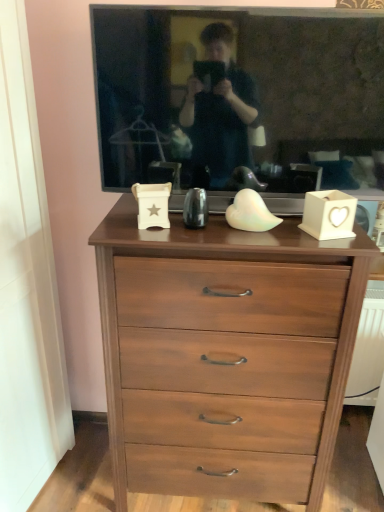
Question: Is walnut wood chest of drawers at center to the left of matte black tv at upper center from the viewer's perspective?

Choices:
 (A) yes
 (B) no

Answer: (A)

Question: Can you confirm if walnut wood chest of drawers at center is thinner than matte black tv at upper center?

Choices:
 (A) yes
 (B) no

Answer: (B)

Question: From a real-world perspective, is walnut wood chest of drawers at center over matte black tv at upper center?

Choices:
 (A) yes
 (B) no

Answer: (B)

Question: Is walnut wood chest of drawers at center oriented towards matte black tv at upper center?

Choices:
 (A) no
 (B) yes

Answer: (A)

Question: Are walnut wood chest of drawers at center and matte black tv at upper center beside each other?

Choices:
 (A) yes
 (B) no

Answer: (B)

Question: Is walnut wood chest of drawers at center further to camera compared to matte black tv at upper center?

Choices:
 (A) no
 (B) yes

Answer: (B)

Question: Can you confirm if matte black tv at upper center is shorter than walnut wood chest of drawers at center?

Choices:
 (A) no
 (B) yes

Answer: (B)

Question: Is matte black tv at upper center at the left side of walnut wood chest of drawers at center?

Choices:
 (A) yes
 (B) no

Answer: (B)

Question: Is matte black tv at upper center in front of walnut wood chest of drawers at center?

Choices:
 (A) no
 (B) yes

Answer: (B)

Question: From the image's perspective, does matte black tv at upper center appear lower than walnut wood chest of drawers at center?

Choices:
 (A) yes
 (B) no

Answer: (B)

Question: Could walnut wood chest of drawers at center be considered to be inside matte black tv at upper center?

Choices:
 (A) no
 (B) yes

Answer: (A)

Question: From the image's perspective, would you say matte black tv at upper center is positioned over walnut wood chest of drawers at center?

Choices:
 (A) no
 (B) yes

Answer: (B)

Question: Relative to matte black tv at upper center, is walnut wood chest of drawers at center in front or behind?

Choices:
 (A) behind
 (B) front

Answer: (A)